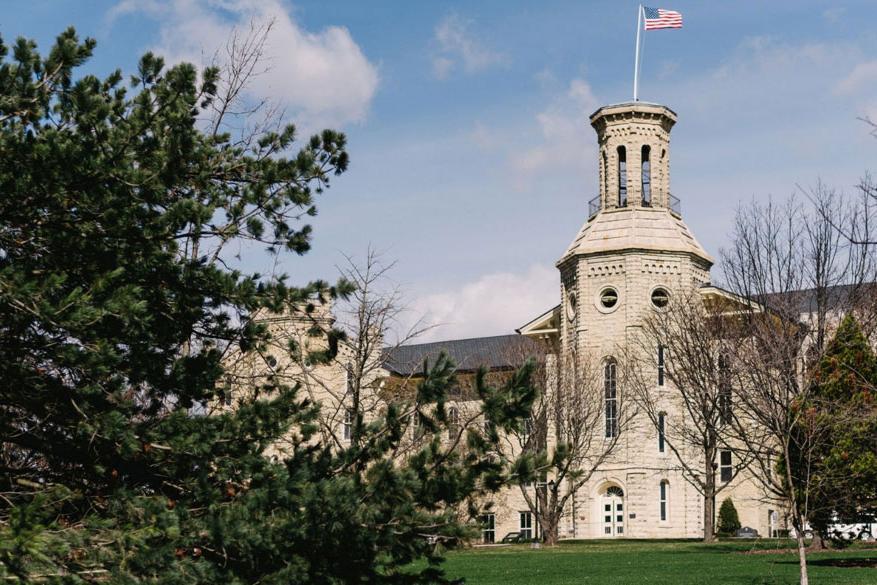
I want to click on door, so click(x=614, y=519).